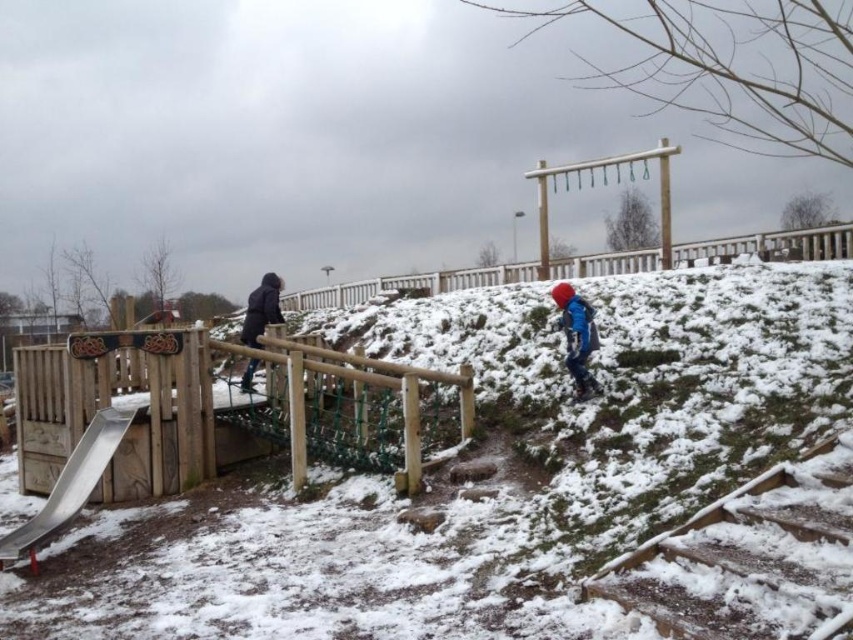
You are a parent trying to locate your child who is playing in the snowy playground. You see the wooden stairs at lower right and the metallic smooth slide at lower left. Which object is nearer to you?

The wooden stairs at lower right is closer to the viewer than the metallic smooth slide at lower left, so the wooden stairs at lower right is nearer to you.

You are a parent trying to carry your child wearing the dark blue jacket at left down the wooden stairs at lower right. Can you fit both yourself and the child on the stairs without exceeding the width?

The wooden stairs at lower right are narrower than the dark blue jacket at left, so it might be difficult to fit both yourself and the child on the stairs without exceeding the width.

Based on the coordinates provided in the scene description, where is the metallic smooth slide at lower left located?

The metallic smooth slide at lower left is located at point (68, 486).